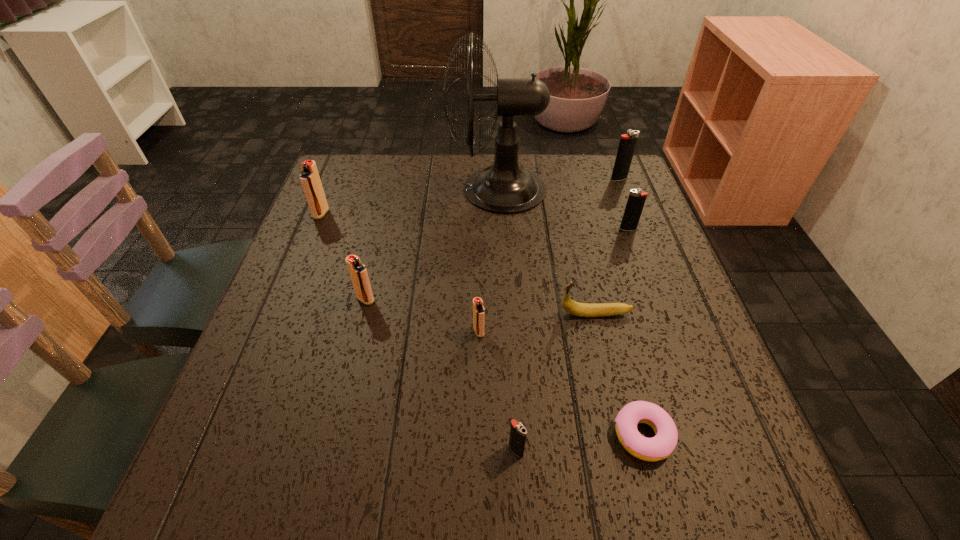
Find the location of a particular element. This screenshot has height=540, width=960. blank area at the near edge is located at coordinates (661, 487).

At what (x,y) coordinates should I click in order to perform the action: click on free space at the left edge. Please return your answer as a coordinate pair (x, y). Image resolution: width=960 pixels, height=540 pixels. Looking at the image, I should click on tap(234, 456).

Where is `free space at the right edge of the desktop`? Image resolution: width=960 pixels, height=540 pixels. free space at the right edge of the desktop is located at coordinates (608, 276).

Where is `vacant space at the far left corner of the desktop`? This screenshot has width=960, height=540. vacant space at the far left corner of the desktop is located at coordinates (381, 154).

Identify the location of vacant space in between the biggest black igniter and the second smallest black igniter. (623, 204).

Locate an element on the screen. The width and height of the screenshot is (960, 540). free spot between the leftmost object and the yellow banana is located at coordinates (458, 264).

In order to click on free space between the fourth farthest object and the second red igniter from left to right in this screenshot , I will do `click(496, 264)`.

Find the location of a particular element. vacant area that lies between the banana and the smallest red igniter is located at coordinates (538, 322).

I want to click on vacant area that lies between the yellow banana and the pink doughnut, so click(619, 374).

I want to click on empty space that is in between the banana and the farthest igniter, so click(x=608, y=246).